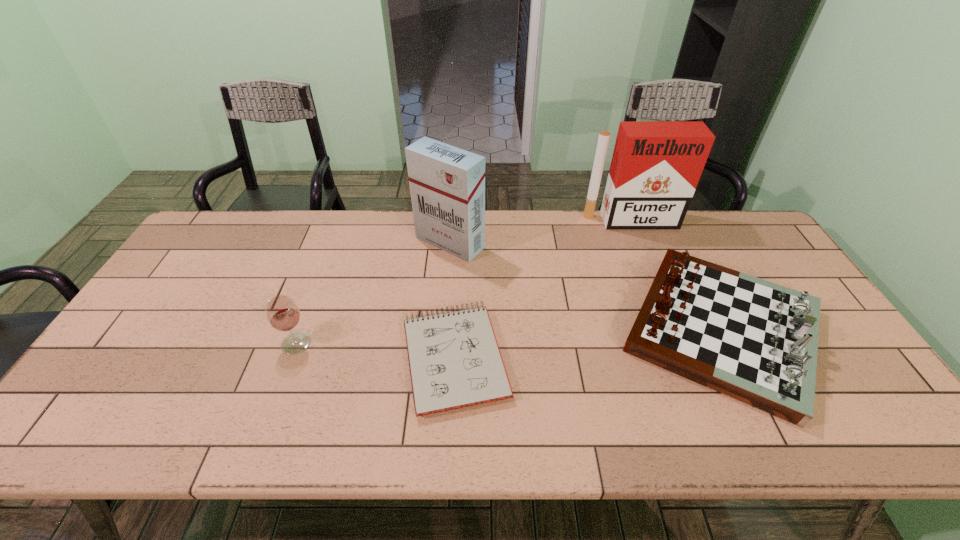
Locate which object is the third closest to the right cigarette case. Please provide its 2D coordinates. Your answer should be formatted as a tuple, i.e. [(x, y)], where the tuple contains the x and y coordinates of a point satisfying the conditions above.

[(454, 359)]

Select which object is the third closest to the left cigarette case. Please provide its 2D coordinates. Your answer should be formatted as a tuple, i.e. [(x, y)], where the tuple contains the x and y coordinates of a point satisfying the conditions above.

[(755, 341)]

Find the location of `free spot that satisfies the following two spatial constraints: 1. on the back side of the second shortest object; 2. on the right side of the shortest object`. free spot that satisfies the following two spatial constraints: 1. on the back side of the second shortest object; 2. on the right side of the shortest object is located at coordinates (457, 330).